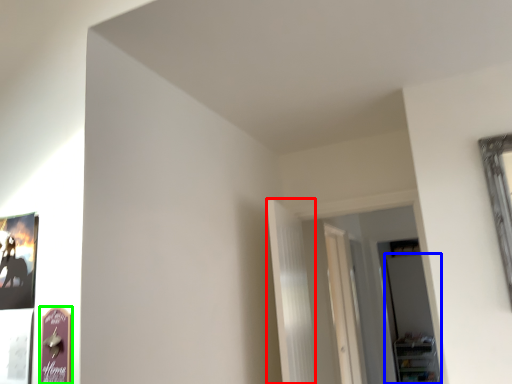
Question: Which object is the farthest from curtain (highlighted by a red box)? Choose among these: glass door (highlighted by a blue box) or picture frame (highlighted by a green box).

Choices:
 (A) glass door
 (B) picture frame

Answer: (A)